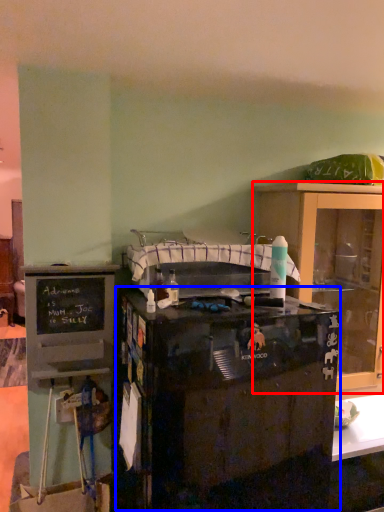
Question: Among these objects, which one is farthest to the camera, cabinetry (highlighted by a red box) or desk (highlighted by a blue box)?

Choices:
 (A) cabinetry
 (B) desk

Answer: (A)